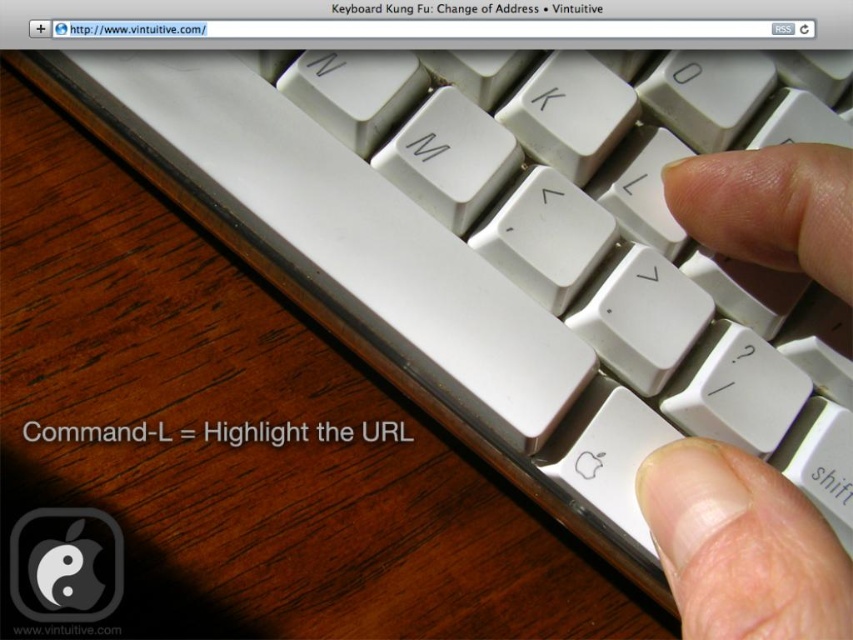
Is point (784, 508) in front of point (720, 483)?

Yes, it is.

You are a GUI agent. You are given a task and a screenshot of the screen. Output one action in this format:
    pyautogui.click(x=<x>, y=<y>)
    Task: Click on the white plastic finger at center
    
    Given the screenshot: What is the action you would take?
    pyautogui.click(x=741, y=547)

Does point (674, 172) come behind point (715, 531)?

Yes.

Where is `white plastic finger at center`? Image resolution: width=853 pixels, height=640 pixels. white plastic finger at center is located at coordinates (741, 547).